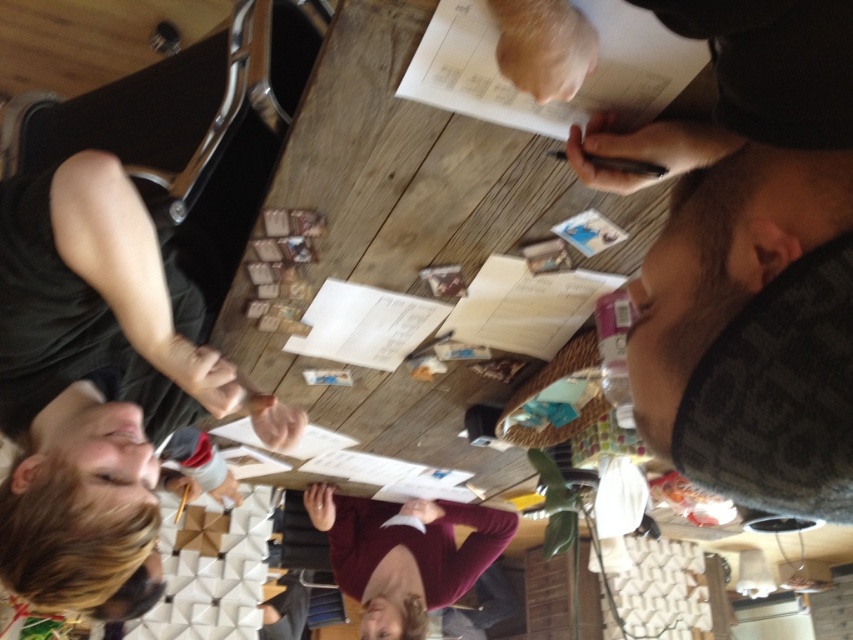
Question: From the image, what is the correct spatial relationship of white paper at upper center in relation to maroon sweater at center?

Choices:
 (A) left
 (B) right

Answer: (B)

Question: Does dark gray textured shirt at upper right appear on the left side of white paper at upper center?

Choices:
 (A) no
 (B) yes

Answer: (A)

Question: Considering the real-world distances, which object is farthest from the dark gray textured shirt at upper right?

Choices:
 (A) white paper at upper center
 (B) maroon sweater at center

Answer: (B)

Question: Is dark gray textured shirt at upper right below white paper at upper center?

Choices:
 (A) no
 (B) yes

Answer: (B)

Question: Which of the following is the closest to the observer?

Choices:
 (A) dark gray textured shirt at upper right
 (B) white paper at upper center

Answer: (A)

Question: Which point appears farthest from the camera in this image?

Choices:
 (A) (701, 308)
 (B) (503, 525)
 (C) (469, 88)

Answer: (B)